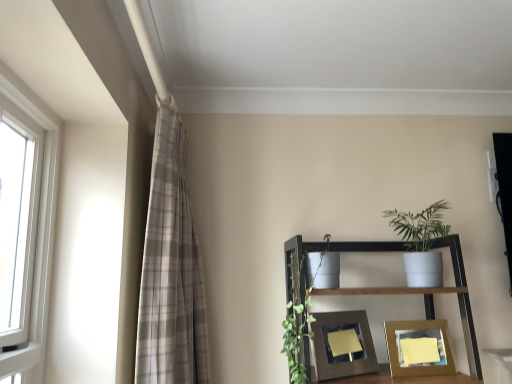
Describe the element at coordinates (40, 210) in the screenshot. This screenshot has height=384, width=512. I see `white plastic window at left` at that location.

You are a GUI agent. You are given a task and a screenshot of the screen. Output one action in this format:
    pyautogui.click(x=<x>, y=<y>)
    Task: Click on the plaid fabric curtain at left
    The height and width of the screenshot is (384, 512).
    Given the screenshot: What is the action you would take?
    pyautogui.click(x=170, y=269)

The height and width of the screenshot is (384, 512). What do you see at coordinates (346, 351) in the screenshot? I see `matte brown picture frame at center, which appears as the second picture frame when viewed from the right` at bounding box center [346, 351].

Find the location of a particular element. The image size is (512, 384). wooden picture frame at lower center, which is the 2th picture frame from left to right is located at coordinates (419, 348).

Is wooden picture frame at lower center, the 1th picture frame from the right, aimed at white matte pot at upper right?

No, wooden picture frame at lower center, the 1th picture frame from the right, is not aimed at white matte pot at upper right.

From a real-world perspective, who is located higher, wooden picture frame at lower center, which is the 2th picture frame from left to right, or white matte pot at upper right?

In real-world perspective, white matte pot at upper right is above.

Does wooden picture frame at lower center, the 1th picture frame from the right, appear on the right side of white matte pot at upper right?

In fact, wooden picture frame at lower center, the 1th picture frame from the right, is to the left of white matte pot at upper right.

Which of these two, matte brown picture frame at center, the 1th picture frame from the left, or white matte pot at upper right, stands taller?

white matte pot at upper right is taller.

Considering the positions of points (325, 350) and (434, 221), is point (325, 350) closer to camera compared to point (434, 221)?

Yes.

From a real-world perspective, is matte brown picture frame at center, the 1th picture frame from the left, on top of white matte pot at upper right?

No, from a real-world perspective, matte brown picture frame at center, the 1th picture frame from the left, is not above white matte pot at upper right.

Considering the relative sizes of wooden picture frame at lower center, the 1th picture frame from the right, and white plastic window at left in the image provided, is wooden picture frame at lower center, the 1th picture frame from the right, taller than white plastic window at left?

Incorrect, the height of wooden picture frame at lower center, the 1th picture frame from the right, is not larger of that of white plastic window at left.

Considering the sizes of objects wooden picture frame at lower center, the 1th picture frame from the right, and white plastic window at left in the image provided, who is smaller, wooden picture frame at lower center, the 1th picture frame from the right, or white plastic window at left?

Smaller between the two is wooden picture frame at lower center, the 1th picture frame from the right.

Is point (416, 342) closer or farther from the camera than point (49, 249)?

Point (416, 342) appears to be farther away from the viewer than point (49, 249).

What's the angular difference between wooden picture frame at lower center, the 1th picture frame from the right, and white plastic window at left's facing directions?

The angle between the facing direction of wooden picture frame at lower center, the 1th picture frame from the right, and the facing direction of white plastic window at left is 85.9 degrees.

Which is correct: plaid fabric curtain at left is inside matte brown picture frame at center, which appears as the second picture frame when viewed from the right, or outside of it?

plaid fabric curtain at left lies outside matte brown picture frame at center, which appears as the second picture frame when viewed from the right.

Considering the relative sizes of plaid fabric curtain at left and matte brown picture frame at center, which appears as the second picture frame when viewed from the right, in the image provided, is plaid fabric curtain at left shorter than matte brown picture frame at center, which appears as the second picture frame when viewed from the right,?

In fact, plaid fabric curtain at left may be taller than matte brown picture frame at center, which appears as the second picture frame when viewed from the right.

Which object is wider, plaid fabric curtain at left or matte brown picture frame at center, the 1th picture frame from the left?

plaid fabric curtain at left is wider.

In the image, is plaid fabric curtain at left positioned in front of or behind matte brown picture frame at center, which appears as the second picture frame when viewed from the right?

plaid fabric curtain at left is in front of matte brown picture frame at center, which appears as the second picture frame when viewed from the right.

Considering the sizes of objects matte brown picture frame at center, which appears as the second picture frame when viewed from the right, and plaid fabric curtain at left in the image provided, who is wider, matte brown picture frame at center, which appears as the second picture frame when viewed from the right, or plaid fabric curtain at left?

Wider between the two is plaid fabric curtain at left.

Which is correct: matte brown picture frame at center, the 1th picture frame from the left, is inside plaid fabric curtain at left, or outside of it?

The correct answer is: outside.

Does matte brown picture frame at center, the 1th picture frame from the left, turn towards plaid fabric curtain at left?

No, matte brown picture frame at center, the 1th picture frame from the left, is not facing towards plaid fabric curtain at left.

Would you consider matte brown picture frame at center, which appears as the second picture frame when viewed from the right, to be distant from plaid fabric curtain at left?

matte brown picture frame at center, which appears as the second picture frame when viewed from the right, is actually quite close to plaid fabric curtain at left.

Considering the relative sizes of white matte pot at upper right and plaid fabric curtain at left in the image provided, is white matte pot at upper right shorter than plaid fabric curtain at left?

Indeed, white matte pot at upper right has a lesser height compared to plaid fabric curtain at left.

Is point (418, 253) closer or farther from the camera than point (159, 203)?

Point (418, 253) is positioned farther from the camera compared to point (159, 203).

Is white matte pot at upper right positioned with its back to plaid fabric curtain at left?

No.

Would you say matte brown picture frame at center, the 1th picture frame from the left, is inside or outside wooden picture frame at lower center, the 1th picture frame from the right?

matte brown picture frame at center, the 1th picture frame from the left, cannot be found inside wooden picture frame at lower center, the 1th picture frame from the right.

Measure the distance between matte brown picture frame at center, which appears as the second picture frame when viewed from the right, and wooden picture frame at lower center, which is the 2th picture frame from left to right.

7.29 inches.

Is matte brown picture frame at center, which appears as the second picture frame when viewed from the right, far away from wooden picture frame at lower center, which is the 2th picture frame from left to right?

matte brown picture frame at center, which appears as the second picture frame when viewed from the right, is near wooden picture frame at lower center, which is the 2th picture frame from left to right, not far away.

Considering the sizes of objects matte brown picture frame at center, which appears as the second picture frame when viewed from the right, and wooden picture frame at lower center, the 1th picture frame from the right, in the image provided, who is taller, matte brown picture frame at center, which appears as the second picture frame when viewed from the right, or wooden picture frame at lower center, the 1th picture frame from the right,?

matte brown picture frame at center, which appears as the second picture frame when viewed from the right.

Identify the location of houseplant behind the wooden picture frame at lower center, the 1th picture frame from the right. (421, 243).

Identify the location of the 1st picture frame below when counting from the white matte pot at upper right (from the image's perspective). This screenshot has height=384, width=512. (346, 351).

In the scene shown: From the image, which object appears to be nearer to white matte pot at upper right, white plastic window at left or plaid fabric curtain at left?

plaid fabric curtain at left is closer to white matte pot at upper right.

Based on their spatial positions, is plaid fabric curtain at left or wooden picture frame at lower center, which is the 2th picture frame from left to right, further from white plastic window at left?

wooden picture frame at lower center, which is the 2th picture frame from left to right, lies further to white plastic window at left than the other object.

When comparing their distances from plaid fabric curtain at left, does wooden picture frame at lower center, which is the 2th picture frame from left to right, or white matte pot at upper right seem closer?

Among the two, wooden picture frame at lower center, which is the 2th picture frame from left to right, is located nearer to plaid fabric curtain at left.

Based on their spatial positions, is white matte pot at upper right or wooden picture frame at lower center, the 1th picture frame from the right, further from white plastic window at left?

Based on the image, white matte pot at upper right appears to be further to white plastic window at left.

Which object lies nearer to the anchor point white plastic window at left, plaid fabric curtain at left or white matte pot at upper right?

Based on the image, plaid fabric curtain at left appears to be nearer to white plastic window at left.

From the image, which object appears to be farther from plaid fabric curtain at left, matte brown picture frame at center, which appears as the second picture frame when viewed from the right, or wooden picture frame at lower center, the 1th picture frame from the right?

wooden picture frame at lower center, the 1th picture frame from the right, is further to plaid fabric curtain at left.

Considering their positions, is white plastic window at left positioned further to matte brown picture frame at center, the 1th picture frame from the left, than wooden picture frame at lower center, which is the 2th picture frame from left to right?

Among the two, white plastic window at left is located further to matte brown picture frame at center, the 1th picture frame from the left.

Which object lies further to the anchor point plaid fabric curtain at left, wooden picture frame at lower center, which is the 2th picture frame from left to right, or matte brown picture frame at center, which appears as the second picture frame when viewed from the right?

wooden picture frame at lower center, which is the 2th picture frame from left to right.

You are a GUI agent. You are given a task and a screenshot of the screen. Output one action in this format:
    pyautogui.click(x=<x>, y=<y>)
    Task: Click on the picture frame between white matte pot at upper right and wooden picture frame at lower center, the 1th picture frame from the right, in the up-down direction
    
    Given the screenshot: What is the action you would take?
    pyautogui.click(x=346, y=351)

Where is `curtain between white plastic window at left and matte brown picture frame at center, which appears as the second picture frame when viewed from the right`? Image resolution: width=512 pixels, height=384 pixels. curtain between white plastic window at left and matte brown picture frame at center, which appears as the second picture frame when viewed from the right is located at coordinates (170, 269).

The image size is (512, 384). I want to click on picture frame between plaid fabric curtain at left and wooden picture frame at lower center, the 1th picture frame from the right, so click(x=346, y=351).

Find the location of a particular element. curtain between white plastic window at left and wooden picture frame at lower center, which is the 2th picture frame from left to right, from left to right is located at coordinates (170, 269).